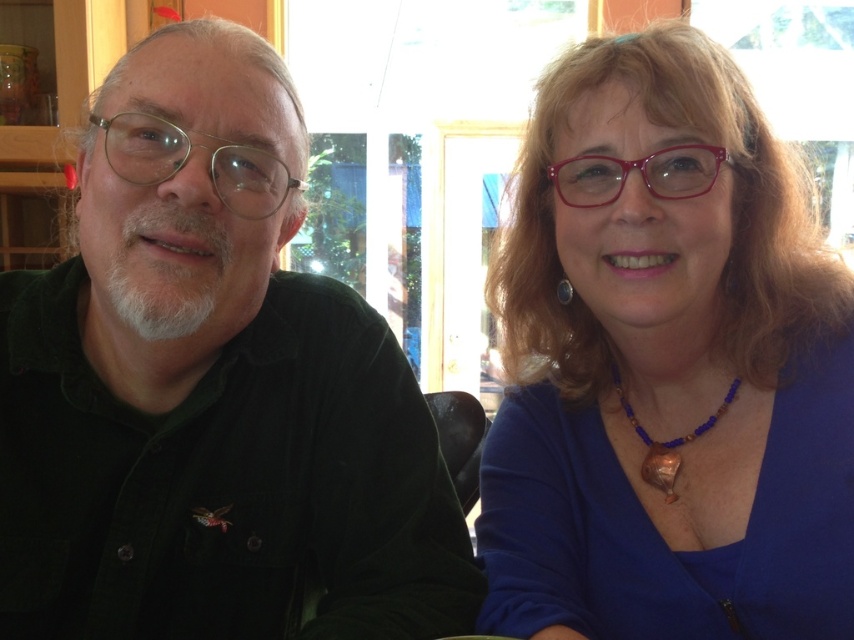
Question: Which object is farther from the camera taking this photo?

Choices:
 (A) blue fabric shirt at upper right
 (B) dark green corduroy shirt at left

Answer: (A)

Question: Does dark green corduroy shirt at left lie behind blue fabric shirt at upper right?

Choices:
 (A) no
 (B) yes

Answer: (A)

Question: Can you confirm if dark green corduroy shirt at left is smaller than blue fabric shirt at upper right?

Choices:
 (A) yes
 (B) no

Answer: (B)

Question: Can you confirm if dark green corduroy shirt at left is positioned above blue fabric shirt at upper right?

Choices:
 (A) no
 (B) yes

Answer: (A)

Question: Which of the following is the closest to the observer?

Choices:
 (A) (550, 307)
 (B) (278, 516)

Answer: (B)